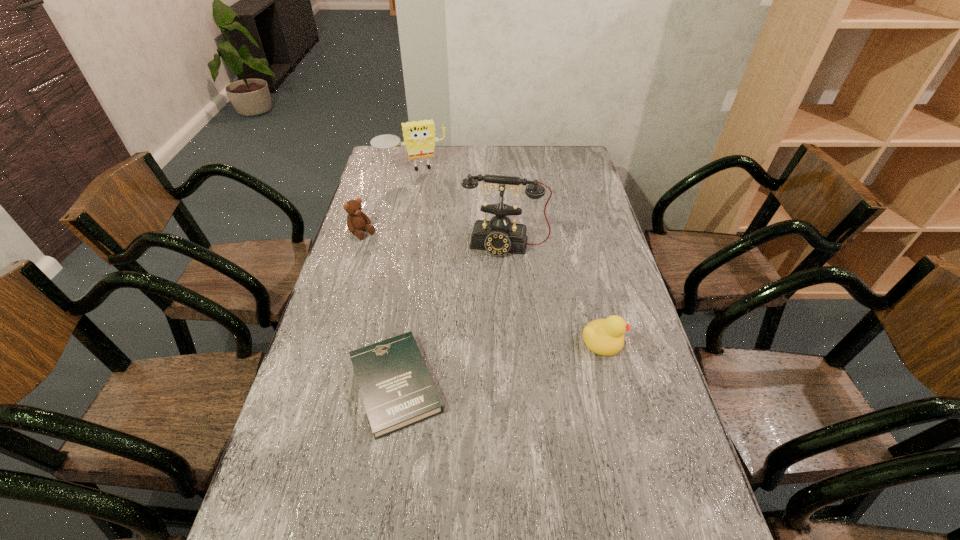
This screenshot has height=540, width=960. I want to click on vacant area in the image that satisfies the following two spatial constraints: 1. on the front side of the rightmost object; 2. on the face of the fourth object from left to right, so click(x=512, y=341).

Where is `blank space that satisfies the following two spatial constraints: 1. on the front side of the farthest object; 2. on the left side of the book`? The width and height of the screenshot is (960, 540). blank space that satisfies the following two spatial constraints: 1. on the front side of the farthest object; 2. on the left side of the book is located at coordinates (366, 384).

Locate an element on the screen. Image resolution: width=960 pixels, height=540 pixels. blank space that satisfies the following two spatial constraints: 1. on the front side of the second shortest object; 2. on the face of the third tallest object is located at coordinates (330, 341).

Locate an element on the screen. The width and height of the screenshot is (960, 540). free point that satisfies the following two spatial constraints: 1. on the front side of the second object from right to left; 2. on the left side of the farthest object is located at coordinates (396, 245).